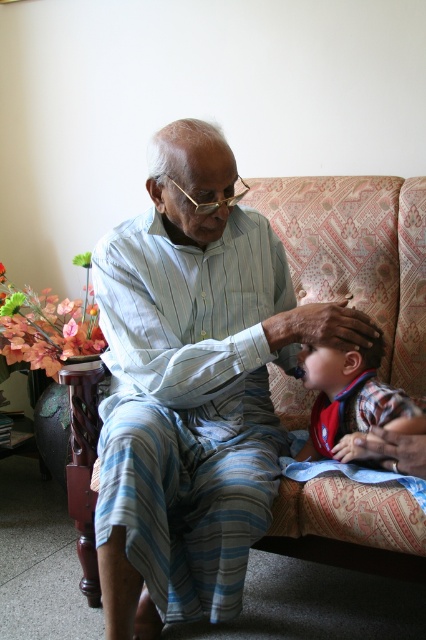
Question: Does light blue striped pajamas at center have a lesser width compared to plaid fabric shirt at lower right?

Choices:
 (A) yes
 (B) no

Answer: (B)

Question: Can you confirm if light blue striped pajamas at center is positioned below plaid fabric shirt at lower right?

Choices:
 (A) yes
 (B) no

Answer: (B)

Question: Which point is farther to the camera?

Choices:
 (A) plaid fabric shirt at lower right
 (B) light blue striped pajamas at center

Answer: (A)

Question: Is the position of light blue striped pajamas at center more distant than that of plaid fabric shirt at lower right?

Choices:
 (A) yes
 (B) no

Answer: (B)

Question: Which point appears closest to the camera in this image?

Choices:
 (A) [x=348, y=376]
 (B) [x=209, y=353]

Answer: (B)